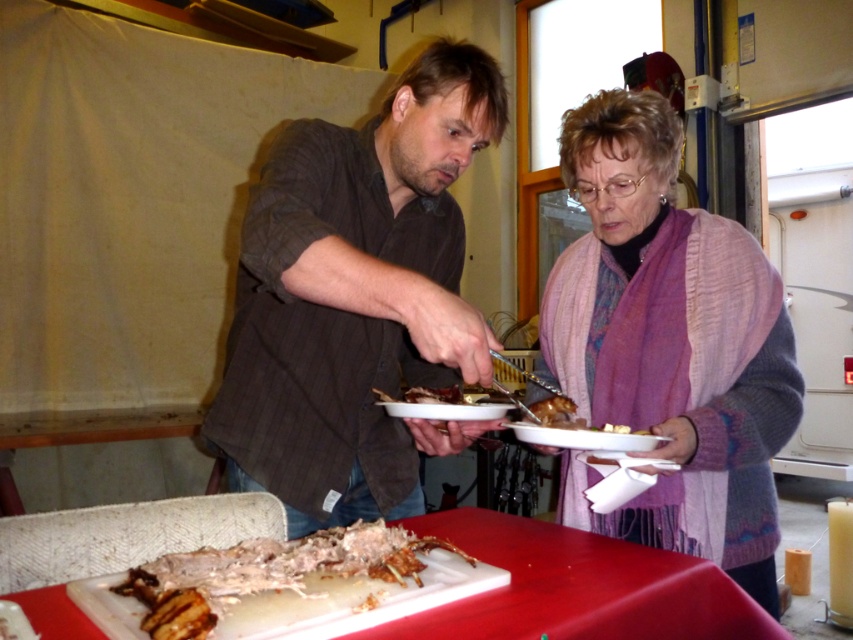
Who is shorter, brown striped shirt at center or white plastic cutting board at lower center?

With less height is white plastic cutting board at lower center.

Can you confirm if brown striped shirt at center is taller than white plastic cutting board at lower center?

Indeed, brown striped shirt at center has a greater height compared to white plastic cutting board at lower center.

Does point (334, 525) come farther from viewer compared to point (737, 612)?

Yes.

Where is `brown striped shirt at center`? Image resolution: width=853 pixels, height=640 pixels. brown striped shirt at center is located at coordinates tap(357, 298).

Is knitted purple scarf at center shorter than grilled meat at center?

No.

Is knitted purple scarf at center to the right of grilled meat at center from the viewer's perspective?

Correct, you'll find knitted purple scarf at center to the right of grilled meat at center.

Where is `knitted purple scarf at center`? knitted purple scarf at center is located at coordinates (669, 344).

Measure the distance between white plastic cutting board at lower center and grilled meat at center.

white plastic cutting board at lower center is 17.61 centimeters from grilled meat at center.

Locate an element on the screen. The height and width of the screenshot is (640, 853). white plastic cutting board at lower center is located at coordinates (578, 588).